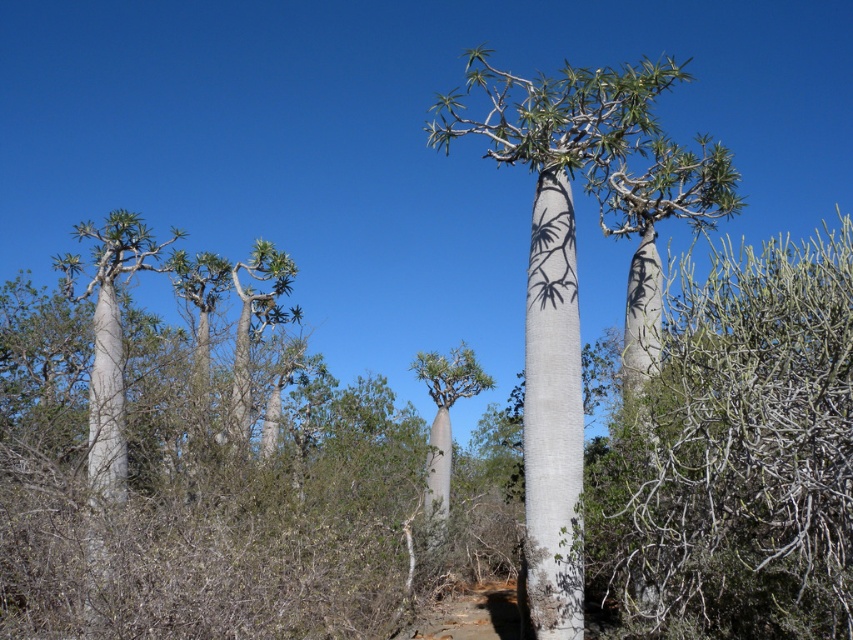
Question: Can you confirm if white bark tree at center is positioned above white smooth baobab tree at center?

Choices:
 (A) no
 (B) yes

Answer: (A)

Question: Which point is closer to the camera?

Choices:
 (A) (527, 589)
 (B) (415, 369)
 (C) (659, 467)

Answer: (C)

Question: Can you confirm if white bark tree at center is bigger than green leafy tree at center?

Choices:
 (A) yes
 (B) no

Answer: (B)

Question: Does white smooth baobab tree at center appear on the left side of green leafy tree at center?

Choices:
 (A) no
 (B) yes

Answer: (A)

Question: Among these objects, which one is nearest to the camera?

Choices:
 (A) white smooth baobab tree at center
 (B) white bark tree at center

Answer: (A)

Question: Which object is positioned farthest from the white bark tree at center?

Choices:
 (A) white smooth baobab tree at center
 (B) green leafy tree at center

Answer: (B)